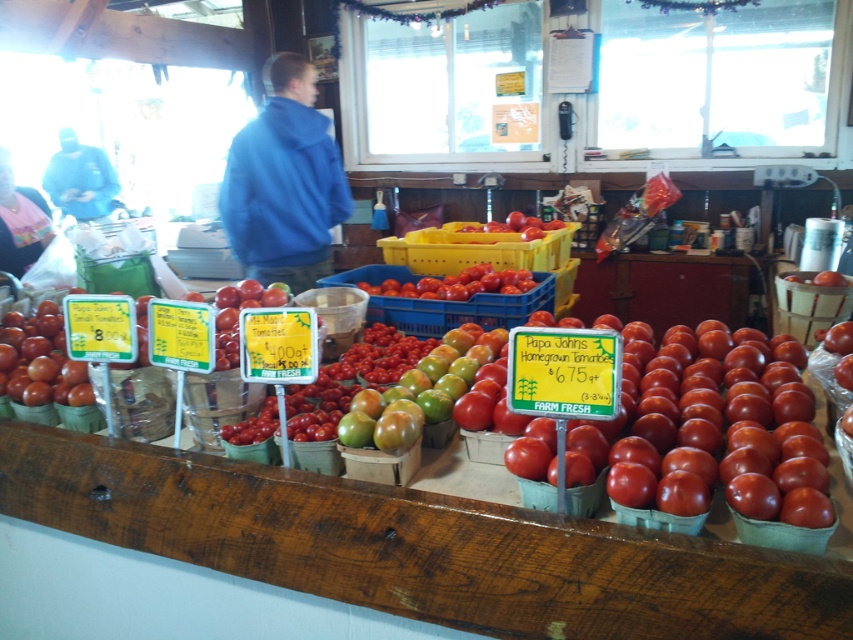
Who is lower down, blue fleece jacket at center or green matte tomatoes at center?

Positioned lower is green matte tomatoes at center.

Which is in front, point (236, 177) or point (492, 348)?

Point (492, 348) is more forward.

Find the location of a particular element. blue fleece jacket at center is located at coordinates (283, 182).

This screenshot has width=853, height=640. In order to click on blue fleece jacket at center in this screenshot , I will do `click(283, 182)`.

This screenshot has height=640, width=853. What do you see at coordinates (283, 182) in the screenshot? I see `blue fleece jacket at center` at bounding box center [283, 182].

Can you confirm if blue fleece jacket at center is positioned to the left of shiny red tomatoes at center?

Correct, you'll find blue fleece jacket at center to the left of shiny red tomatoes at center.

Between point (273, 164) and point (534, 220), which one is positioned behind?

The point (534, 220) is more distant.

Where is `blue fleece jacket at center`? The width and height of the screenshot is (853, 640). blue fleece jacket at center is located at coordinates [283, 182].

Is blue fleece jacket at center closer to camera compared to pink fabric at left?

Yes, blue fleece jacket at center is in front of pink fabric at left.

Is blue fleece jacket at center to the left of pink fabric at left from the viewer's perspective?

In fact, blue fleece jacket at center is to the right of pink fabric at left.

This screenshot has height=640, width=853. Find the location of `blue fleece jacket at center`. blue fleece jacket at center is located at coordinates (283, 182).